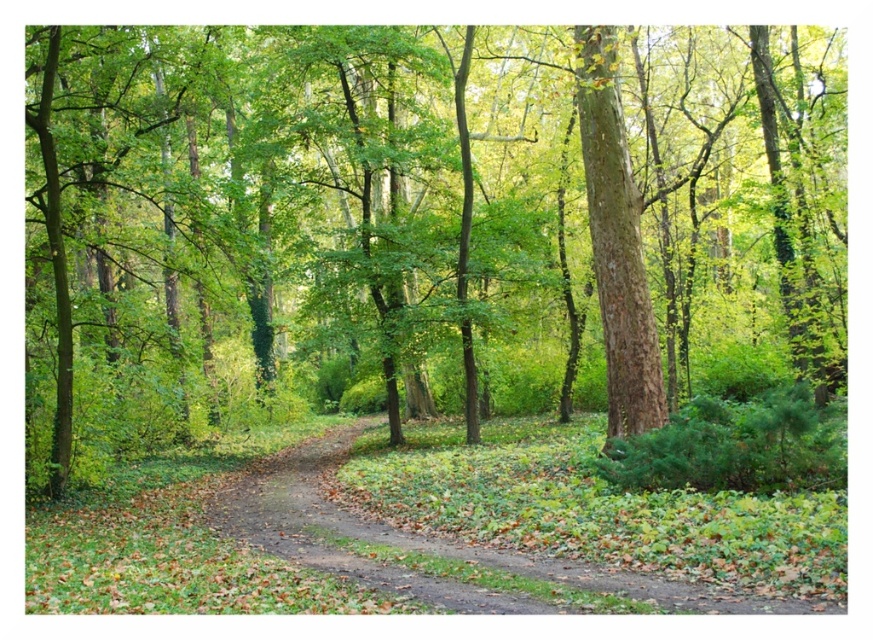
You are standing at the starting point of the dirt path in the forest scene. You want to find the brown rough tree at center. According to the coordinates provided, in which direction should you move from your current position to reach it?

The brown rough tree at center is located at coordinates point (414, 220). Since you are at the starting point of the dirt path, which is likely at the beginning of the path, you should move forward along the path towards the center of the scene to reach the brown rough tree at center.